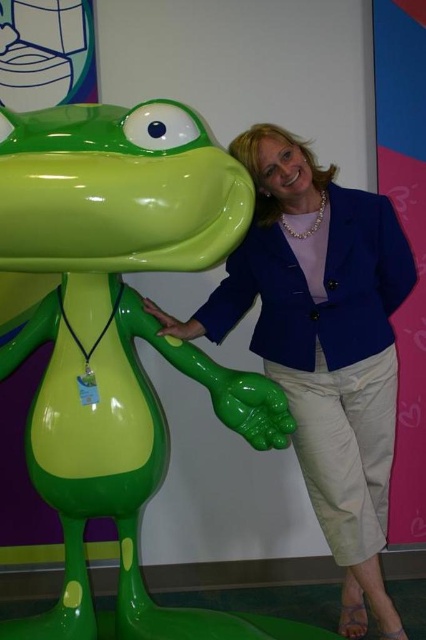
Who is positioned more to the right, glossy plastic frog at center or matte green statue at center?

Positioned to the right is matte green statue at center.

Can you confirm if glossy plastic frog at center is smaller than matte green statue at center?

No.

What do you see at coordinates (120, 337) in the screenshot? This screenshot has height=640, width=426. I see `glossy plastic frog at center` at bounding box center [120, 337].

Find the location of `glossy plastic frog at center`. glossy plastic frog at center is located at coordinates (120, 337).